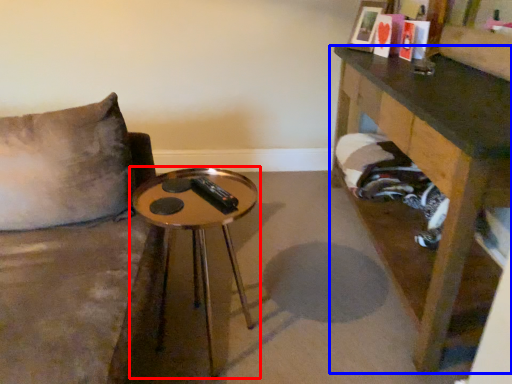
Question: Which object is further to the camera taking this photo, table (highlighted by a red box) or table (highlighted by a blue box)?

Choices:
 (A) table
 (B) table

Answer: (A)